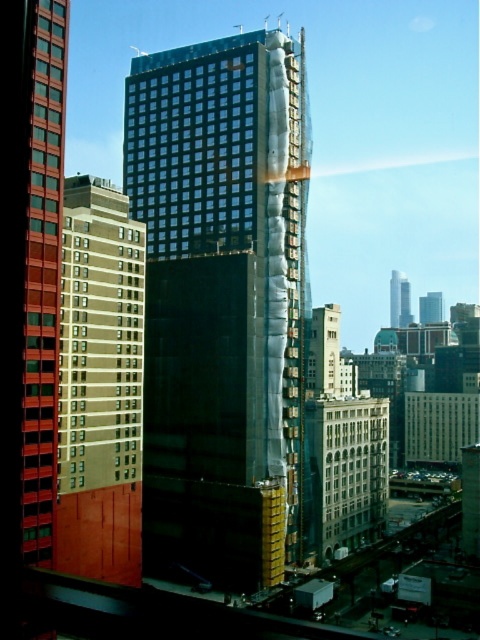
Based on the photo, you are an architect reviewing the construction plans for the black glass building at center and the glassy reflective windows at center. Which one of these two elements is the taller one?

The black glass building at center is much taller as glassy reflective windows at center.

You are an architect reviewing a city layout. You notice the black glass building at center and the glassy steel skyscraper at upper right. Which building is positioned to the left of the other?

The black glass building at center is positioned to the left of the glassy steel skyscraper at upper right.

You are a city planner reviewing a construction site. You notice two buildings in the scene. The first is the black glass building at center, and the second is the smooth glass skyscraper at center. Based on the provided information, which building could potentially have a larger floor area if they have the same number of floors?

The black glass building at center might have a larger floor area than the smooth glass skyscraper at center since it is possibly wider according to the description.